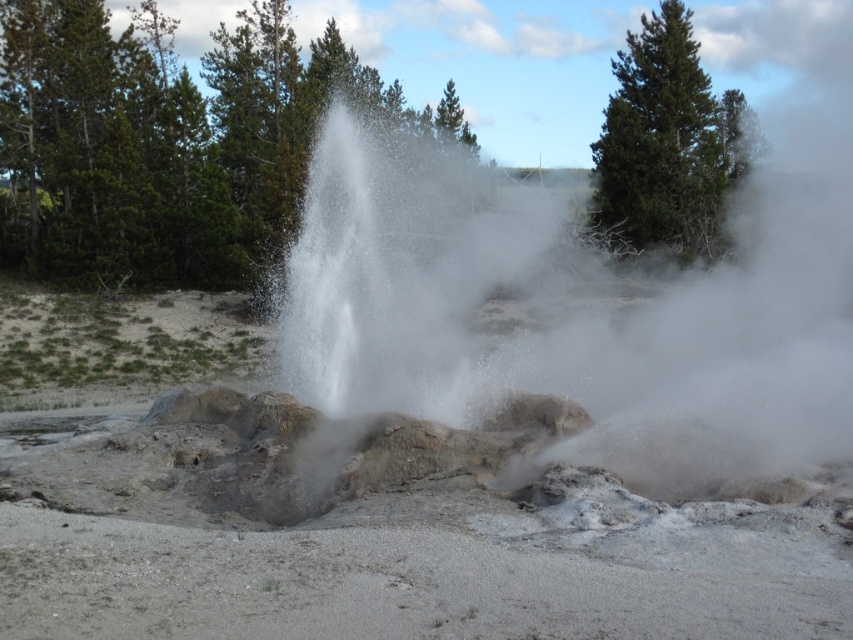
You are a photographer aiming to capture the geyser eruption. You have a camera with a wide angle lens that can focus on objects within 10 meters. The white dusty steam at center and the green matte pine at upper right are both in your view. Can you focus on both objects simultaneously?

The white dusty steam at center is positioned under green matte pine at upper right, so they are in the same general area. Since the camera can focus on objects within 10 meters, and both are within that range, you can focus on both simultaneously.